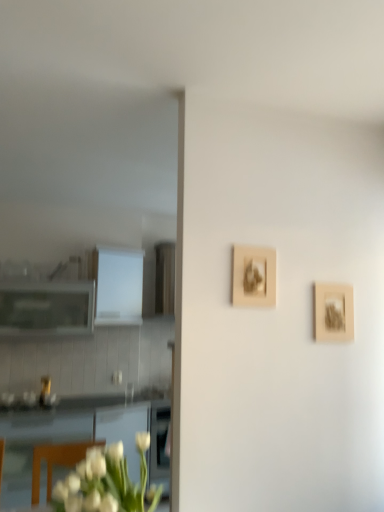
Image resolution: width=384 pixels, height=512 pixels. What do you see at coordinates (104, 481) in the screenshot?
I see `white matte flower at lower left` at bounding box center [104, 481].

What do you see at coordinates (333, 312) in the screenshot? I see `wooden frame at right, which is counted as the second picture frame, starting from the left` at bounding box center [333, 312].

Identify the location of white glossy cabinet at left, acting as the first cabinetry starting from the right. (119, 286).

What is the approximate width of beige textured frame at upper center, the first picture frame positioned from the front?

beige textured frame at upper center, the first picture frame positioned from the front, is 1.68 inches wide.

What are the coordinates of `white matte flower at lower left` in the screenshot? It's located at (104, 481).

From the image's perspective, which is above, wooden frame at right, the 2th picture frame in the front-to-back sequence, or matte white cabinet at left, acting as the second cabinetry starting from the right?

wooden frame at right, the 2th picture frame in the front-to-back sequence, from the image's perspective.

Does wooden frame at right, positioned as the 1th picture frame in right-to-left order, come behind matte white cabinet at left, acting as the second cabinetry starting from the right?

No, wooden frame at right, positioned as the 1th picture frame in right-to-left order, is closer to the viewer.

Between wooden frame at right, the first picture frame from the back, and matte white cabinet at left, marked as the 1th cabinetry in a left-to-right arrangement, which one has smaller width?

wooden frame at right, the first picture frame from the back.

You are a GUI agent. You are given a task and a screenshot of the screen. Output one action in this format:
    pyautogui.click(x=<x>, y=<y>)
    Task: Click on the 2nd picture frame counting from the right side of the matte white cabinet at left, acting as the second cabinetry starting from the right
    The image size is (384, 512).
    Given the screenshot: What is the action you would take?
    pyautogui.click(x=333, y=312)

Who is smaller, beige textured frame at upper center, which is the second picture frame in back-to-front order, or white glossy cabinet at left, acting as the first cabinetry starting from the right?

With smaller size is beige textured frame at upper center, which is the second picture frame in back-to-front order.

Is beige textured frame at upper center, marked as the first picture frame in a left-to-right arrangement, taller or shorter than white glossy cabinet at left, acting as the first cabinetry starting from the right?

Clearly, beige textured frame at upper center, marked as the first picture frame in a left-to-right arrangement, is shorter compared to white glossy cabinet at left, acting as the first cabinetry starting from the right.

Is beige textured frame at upper center, the first picture frame positioned from the front, touching white glossy cabinet at left, which appears as the 2th cabinetry when viewed from the left?

beige textured frame at upper center, the first picture frame positioned from the front, and white glossy cabinet at left, which appears as the 2th cabinetry when viewed from the left, are clearly separated.

Is white matte flower at lower left in front of or behind white glossy cabinet at left, acting as the first cabinetry starting from the right, in the image?

In the image, white matte flower at lower left appears in front of white glossy cabinet at left, acting as the first cabinetry starting from the right.

You are a GUI agent. You are given a task and a screenshot of the screen. Output one action in this format:
    pyautogui.click(x=<x>, y=<y>)
    Task: Click on the flower below the white glossy cabinet at left, which appears as the 2th cabinetry when viewed from the left (from the image's perspective)
    The image size is (384, 512).
    Given the screenshot: What is the action you would take?
    pyautogui.click(x=104, y=481)

Considering the relative sizes of white matte flower at lower left and white glossy cabinet at left, acting as the first cabinetry starting from the right, in the image provided, is white matte flower at lower left smaller than white glossy cabinet at left, acting as the first cabinetry starting from the right,?

Correct, white matte flower at lower left occupies less space than white glossy cabinet at left, acting as the first cabinetry starting from the right.

Can you confirm if white matte flower at lower left is smaller than wooden frame at right, the first picture frame from the back?

Actually, white matte flower at lower left might be larger than wooden frame at right, the first picture frame from the back.

Considering the sizes of white matte flower at lower left and wooden frame at right, the 2th picture frame in the front-to-back sequence, in the image, is white matte flower at lower left wider or thinner than wooden frame at right, the 2th picture frame in the front-to-back sequence,?

Considering their sizes, white matte flower at lower left looks broader than wooden frame at right, the 2th picture frame in the front-to-back sequence.

Is white matte flower at lower left inside the boundaries of wooden frame at right, which is counted as the second picture frame, starting from the left, or outside?

white matte flower at lower left is spatially situated outside wooden frame at right, which is counted as the second picture frame, starting from the left.

Is white matte flower at lower left placed right next to wooden frame at right, positioned as the 1th picture frame in right-to-left order?

No, white matte flower at lower left is not touching wooden frame at right, positioned as the 1th picture frame in right-to-left order.

How much distance is there between wooden frame at right, positioned as the 1th picture frame in right-to-left order, and beige textured frame at upper center, placed as the second picture frame when sorted from right to left?

12.65 inches.

Is beige textured frame at upper center, marked as the first picture frame in a left-to-right arrangement, completely or partially inside wooden frame at right, which is counted as the second picture frame, starting from the left?

No, beige textured frame at upper center, marked as the first picture frame in a left-to-right arrangement, is located outside of wooden frame at right, which is counted as the second picture frame, starting from the left.

Which is in front, wooden frame at right, the first picture frame from the back, or beige textured frame at upper center, the first picture frame positioned from the front?

beige textured frame at upper center, the first picture frame positioned from the front.

From a real-world perspective, who is located higher, wooden frame at right, positioned as the 1th picture frame in right-to-left order, or beige textured frame at upper center, the first picture frame positioned from the front?

beige textured frame at upper center, the first picture frame positioned from the front.

This screenshot has height=512, width=384. Identify the location of the 1st picture frame to the right when counting from the white matte flower at lower left. (253, 276).

How different are the orientations of white matte flower at lower left and beige textured frame at upper center, the first picture frame positioned from the front, in degrees?

white matte flower at lower left and beige textured frame at upper center, the first picture frame positioned from the front, are facing 4.08 degrees away from each other.

How much distance is there between white matte flower at lower left and beige textured frame at upper center, the first picture frame positioned from the front?

white matte flower at lower left and beige textured frame at upper center, the first picture frame positioned from the front, are 34.24 inches apart from each other.

In the image, is white matte flower at lower left on the left side or the right side of beige textured frame at upper center, which is the second picture frame in back-to-front order?

white matte flower at lower left is to the left of beige textured frame at upper center, which is the second picture frame in back-to-front order.

Is beige textured frame at upper center, the first picture frame positioned from the front, next to white matte flower at lower left?

beige textured frame at upper center, the first picture frame positioned from the front, and white matte flower at lower left are clearly separated.

Between beige textured frame at upper center, which is the second picture frame in back-to-front order, and white matte flower at lower left, which one appears on the right side from the viewer's perspective?

From the viewer's perspective, beige textured frame at upper center, which is the second picture frame in back-to-front order, appears more on the right side.

At what (x,y) coordinates should I click in order to perform the action: click on picture frame that is the 1st one when counting rightward from the white matte flower at lower left. Please return your answer as a coordinate pair (x, y). Looking at the image, I should click on (253, 276).

Does point (255, 270) come closer to viewer compared to point (140, 457)?

Yes, it is.

Starting from the wooden frame at right, which is counted as the second picture frame, starting from the left, which cabinetry is the 2nd one to the left? Please provide its 2D coordinates.

[(46, 308)]

Find the location of a particular element. The height and width of the screenshot is (512, 384). the 1st picture frame below the white glossy cabinet at left, which appears as the 2th cabinetry when viewed from the left (from a real-world perspective) is located at coordinates (253, 276).

Which object lies nearer to the anchor point wooden frame at right, the 2th picture frame in the front-to-back sequence, beige textured frame at upper center, which is the second picture frame in back-to-front order, or white matte flower at lower left?

beige textured frame at upper center, which is the second picture frame in back-to-front order, is closer to wooden frame at right, the 2th picture frame in the front-to-back sequence.

When comparing their distances from wooden frame at right, the first picture frame from the back, does matte white cabinet at left, acting as the second cabinetry starting from the right, or beige textured frame at upper center, marked as the first picture frame in a left-to-right arrangement, seem further?

matte white cabinet at left, acting as the second cabinetry starting from the right, lies further to wooden frame at right, the first picture frame from the back, than the other object.

Estimate the real-world distances between objects in this image. Which object is further from white matte flower at lower left, white glossy cabinet at left, which appears as the 2th cabinetry when viewed from the left, or matte white cabinet at left, marked as the 1th cabinetry in a left-to-right arrangement?

white glossy cabinet at left, which appears as the 2th cabinetry when viewed from the left, is further to white matte flower at lower left.

When comparing their distances from white glossy cabinet at left, which appears as the 2th cabinetry when viewed from the left, does wooden frame at right, the 2th picture frame in the front-to-back sequence, or matte white cabinet at left, acting as the second cabinetry starting from the right, seem closer?

The object closer to white glossy cabinet at left, which appears as the 2th cabinetry when viewed from the left, is matte white cabinet at left, acting as the second cabinetry starting from the right.

From the picture: Considering their positions, is matte white cabinet at left, marked as the 1th cabinetry in a left-to-right arrangement, positioned further to beige textured frame at upper center, marked as the first picture frame in a left-to-right arrangement, than white glossy cabinet at left, acting as the first cabinetry starting from the right?

Based on the image, matte white cabinet at left, marked as the 1th cabinetry in a left-to-right arrangement, appears to be further to beige textured frame at upper center, marked as the first picture frame in a left-to-right arrangement.

Consider the image. Which object lies further to the anchor point white glossy cabinet at left, acting as the first cabinetry starting from the right, beige textured frame at upper center, the first picture frame positioned from the front, or matte white cabinet at left, acting as the second cabinetry starting from the right?

beige textured frame at upper center, the first picture frame positioned from the front, lies further to white glossy cabinet at left, acting as the first cabinetry starting from the right, than the other object.

Looking at the image, which one is located further to matte white cabinet at left, marked as the 1th cabinetry in a left-to-right arrangement, beige textured frame at upper center, placed as the second picture frame when sorted from right to left, or wooden frame at right, positioned as the 1th picture frame in right-to-left order?

wooden frame at right, positioned as the 1th picture frame in right-to-left order, lies further to matte white cabinet at left, marked as the 1th cabinetry in a left-to-right arrangement, than the other object.

Based on their spatial positions, is matte white cabinet at left, acting as the second cabinetry starting from the right, or white matte flower at lower left further from white glossy cabinet at left, acting as the first cabinetry starting from the right?

white matte flower at lower left is further to white glossy cabinet at left, acting as the first cabinetry starting from the right.

Locate an element on the screen. The height and width of the screenshot is (512, 384). picture frame between beige textured frame at upper center, placed as the second picture frame when sorted from right to left, and white glossy cabinet at left, which appears as the 2th cabinetry when viewed from the left, in the front-back direction is located at coordinates (333, 312).

Identify the location of cabinetry between beige textured frame at upper center, the first picture frame positioned from the front, and white glossy cabinet at left, which appears as the 2th cabinetry when viewed from the left, from front to back. (46, 308).

This screenshot has width=384, height=512. Find the location of `cabinetry between white matte flower at lower left and white glossy cabinet at left, which appears as the 2th cabinetry when viewed from the left, along the z-axis`. cabinetry between white matte flower at lower left and white glossy cabinet at left, which appears as the 2th cabinetry when viewed from the left, along the z-axis is located at coordinates (46, 308).

The height and width of the screenshot is (512, 384). What are the coordinates of `cabinetry located between matte white cabinet at left, marked as the 1th cabinetry in a left-to-right arrangement, and wooden frame at right, which is counted as the second picture frame, starting from the left, in the left-right direction` in the screenshot? It's located at (119, 286).